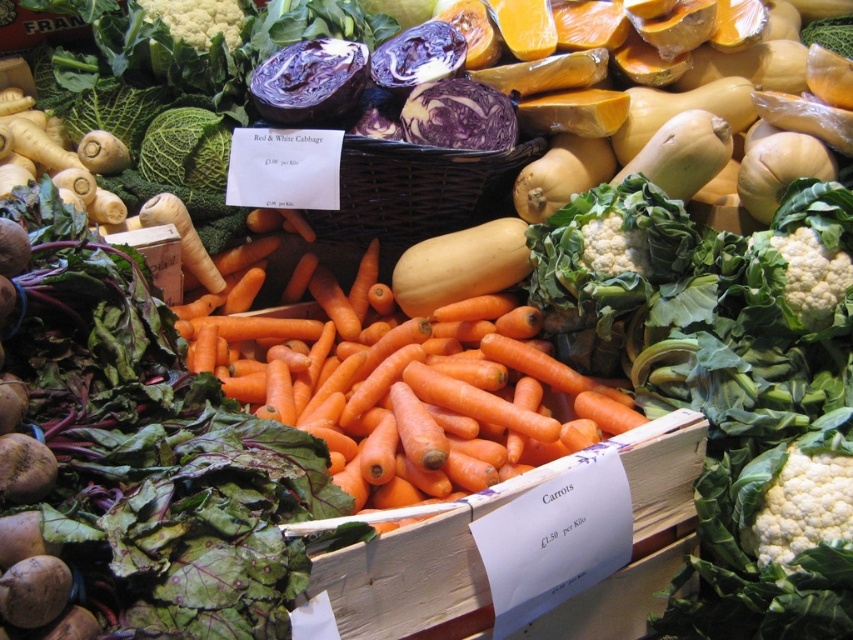
Question: Which object appears farthest from the camera in this image?

Choices:
 (A) purple smooth cabbage at center
 (B) orange matte carrots at center
 (C) white leafy broccoli at lower right
 (D) green leafy broccoli at upper left

Answer: (D)

Question: Does green leafy cabbage at upper left appear on the right side of green leafy broccoli at upper left?

Choices:
 (A) yes
 (B) no

Answer: (A)

Question: Which point appears closest to the camera in this image?

Choices:
 (A) (526, 444)
 (B) (796, 509)
 (C) (173, 131)

Answer: (B)

Question: Estimate the real-world distances between objects in this image. Which object is farther from the green leafy cabbage at upper left?

Choices:
 (A) orange matte carrots at center
 (B) purple smooth cabbage at center

Answer: (A)

Question: Is white leafy broccoli at lower right to the right of green leafy cabbage at upper left from the viewer's perspective?

Choices:
 (A) yes
 (B) no

Answer: (A)

Question: From the image, what is the correct spatial relationship of orange matte carrots at center in relation to green leafy broccoli at upper left?

Choices:
 (A) right
 (B) left

Answer: (A)